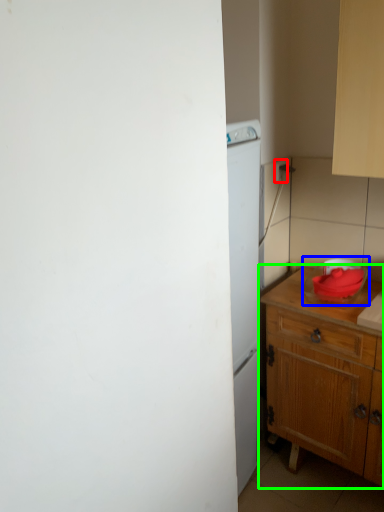
Question: Considering the real-world distances, which object is farthest from electric outlet (highlighted by a red box)? appliance (highlighted by a blue box) or table (highlighted by a green box)?

Choices:
 (A) appliance
 (B) table

Answer: (B)